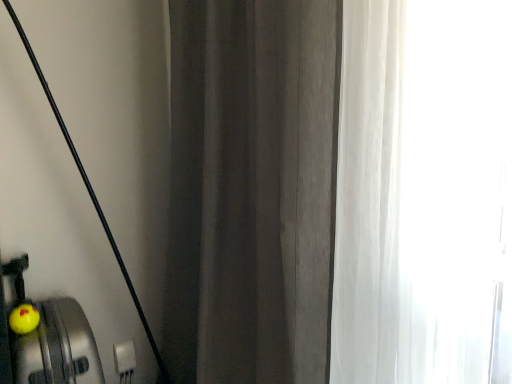
Question: Is dark gray fabric curtain at center inside or outside of yellow rubber duck at lower left?

Choices:
 (A) outside
 (B) inside

Answer: (A)

Question: Considering the positions of dark gray fabric curtain at center and yellow rubber duck at lower left in the image, is dark gray fabric curtain at center wider or thinner than yellow rubber duck at lower left?

Choices:
 (A) thin
 (B) wide

Answer: (B)

Question: Considering the positions of dark gray fabric curtain at center and yellow rubber duck at lower left in the image, is dark gray fabric curtain at center bigger or smaller than yellow rubber duck at lower left?

Choices:
 (A) small
 (B) big

Answer: (B)

Question: Based on their sizes in the image, would you say yellow rubber duck at lower left is bigger or smaller than dark gray fabric curtain at center?

Choices:
 (A) small
 (B) big

Answer: (A)

Question: From a real-world perspective, is yellow rubber duck at lower left above or below dark gray fabric curtain at center?

Choices:
 (A) above
 (B) below

Answer: (B)

Question: Relative to dark gray fabric curtain at center, is yellow rubber duck at lower left in front or behind?

Choices:
 (A) behind
 (B) front

Answer: (A)

Question: In terms of width, does yellow rubber duck at lower left look wider or thinner when compared to dark gray fabric curtain at center?

Choices:
 (A) wide
 (B) thin

Answer: (B)